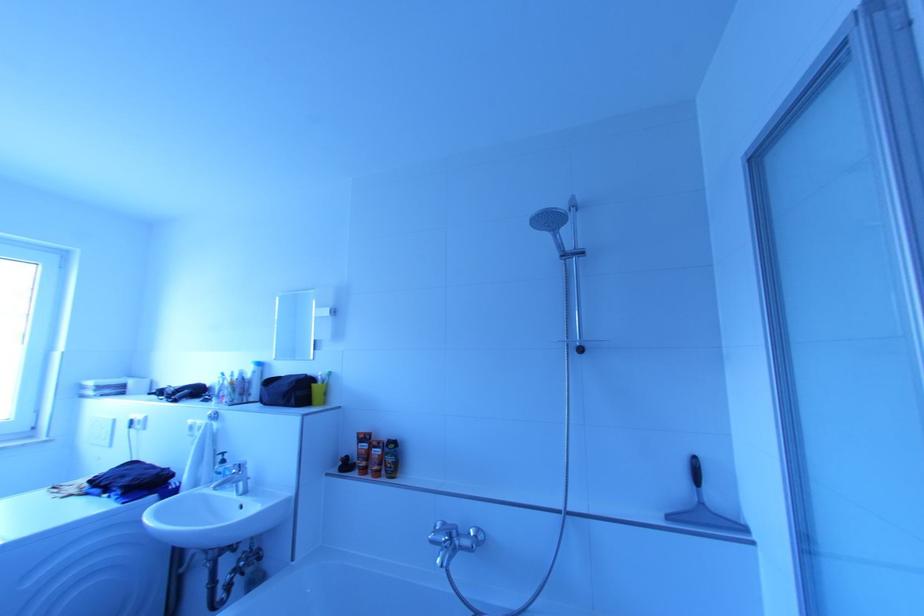
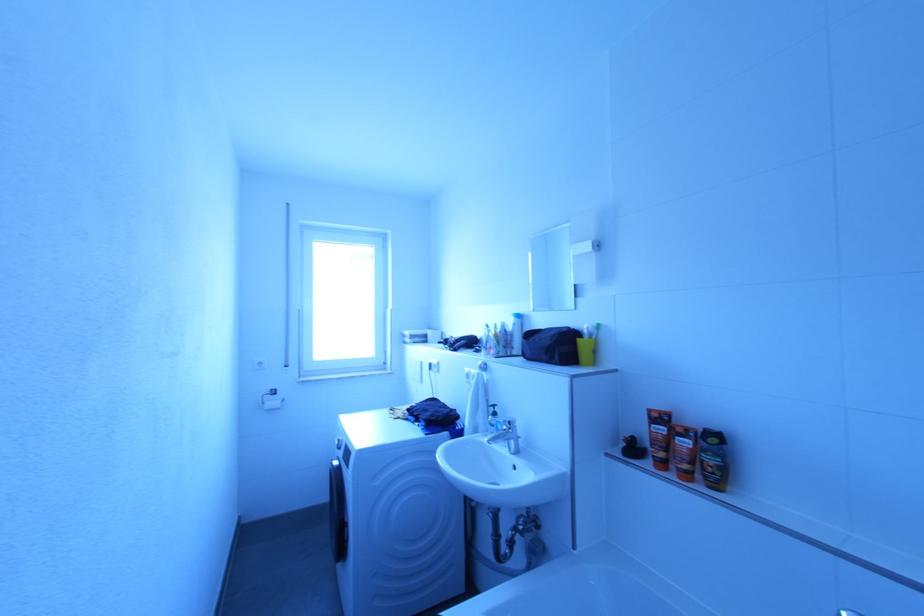
Question: The camera is either moving clockwise (left) or counter-clockwise (right) around the object. The first image is from the beginning of the video and the second image is from the end. Is the camera moving left or right when shooting the video?

Choices:
 (A) Left
 (B) Right

Answer: (B)